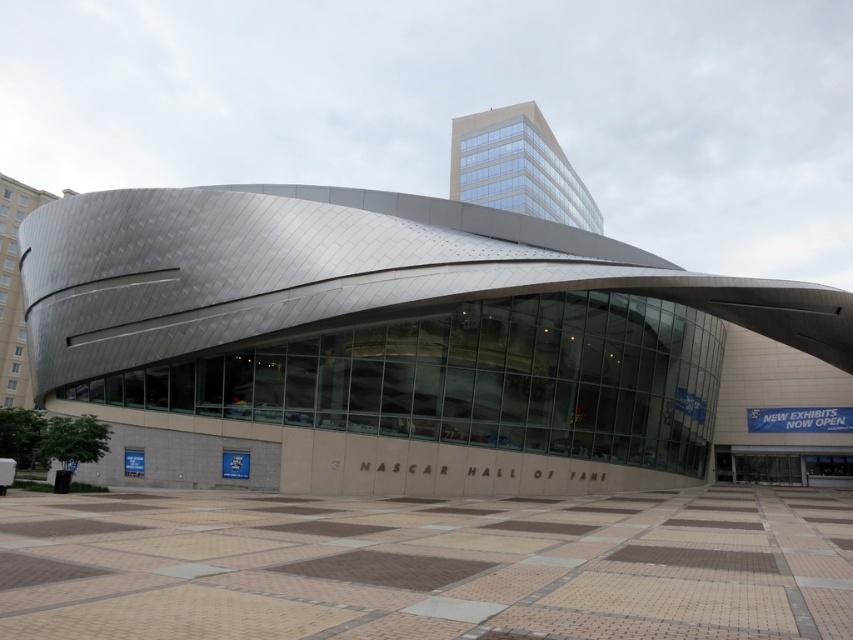
Looking at this image, is polished steel building at center taller than glassy reflective building at upper center?

Yes.

Is point (366, 252) behind point (531, 134)?

No, it is in front of (531, 134).

You are a GUI agent. You are given a task and a screenshot of the screen. Output one action in this format:
    pyautogui.click(x=<x>, y=<y>)
    Task: Click on the polished steel building at center
    This screenshot has height=640, width=853.
    Given the screenshot: What is the action you would take?
    pyautogui.click(x=413, y=346)